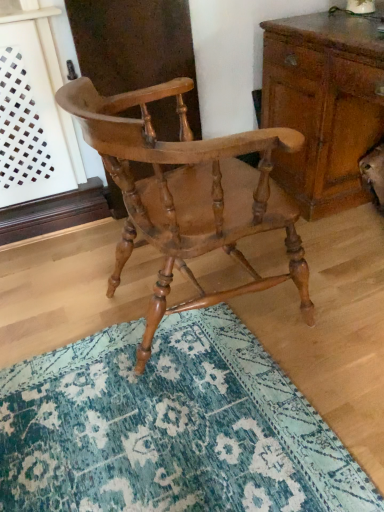
Where is `blank space situated above teal textured rug at center (from a real-world perspective)`? The width and height of the screenshot is (384, 512). blank space situated above teal textured rug at center (from a real-world perspective) is located at coordinates (107, 351).